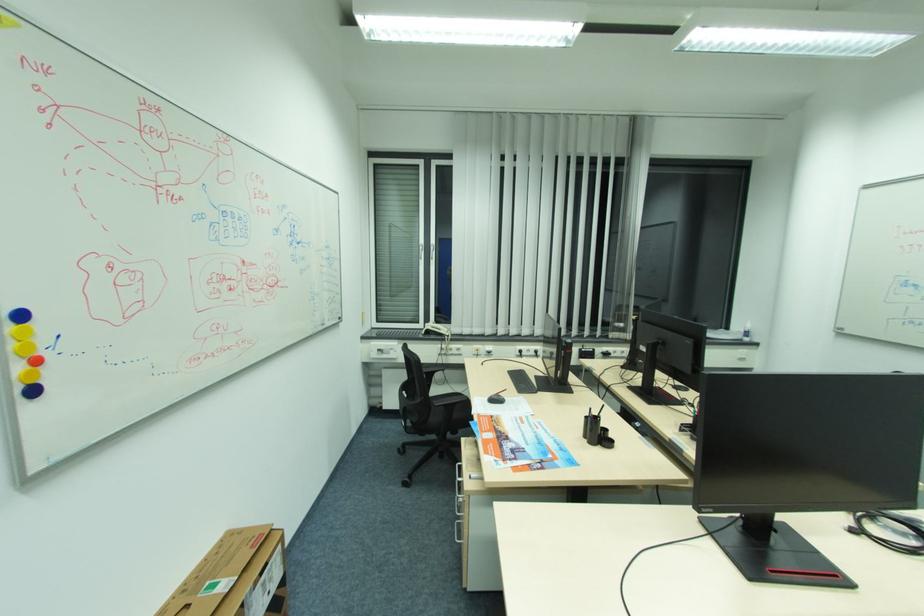
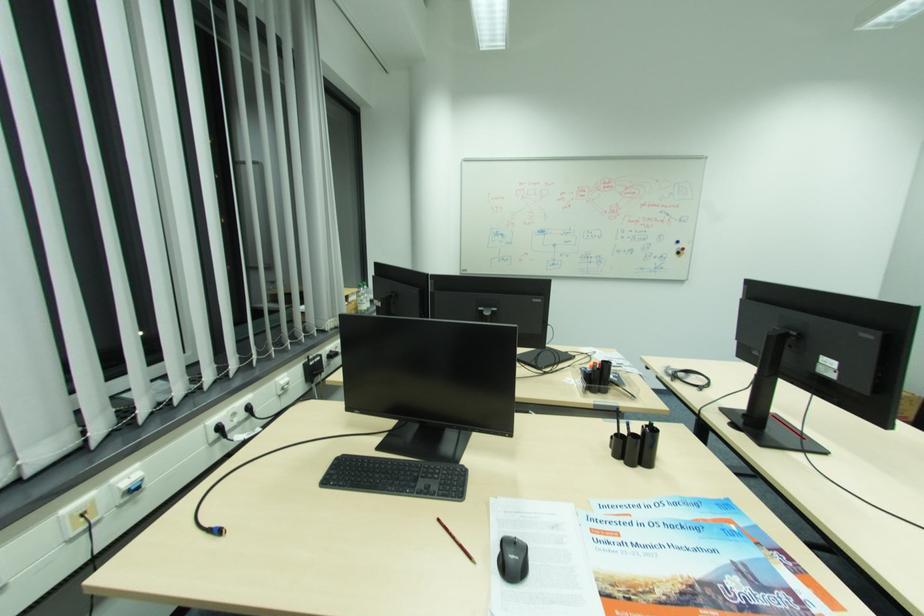
Find the pixel in the second image that matches (487,363) in the first image.

(209, 533)